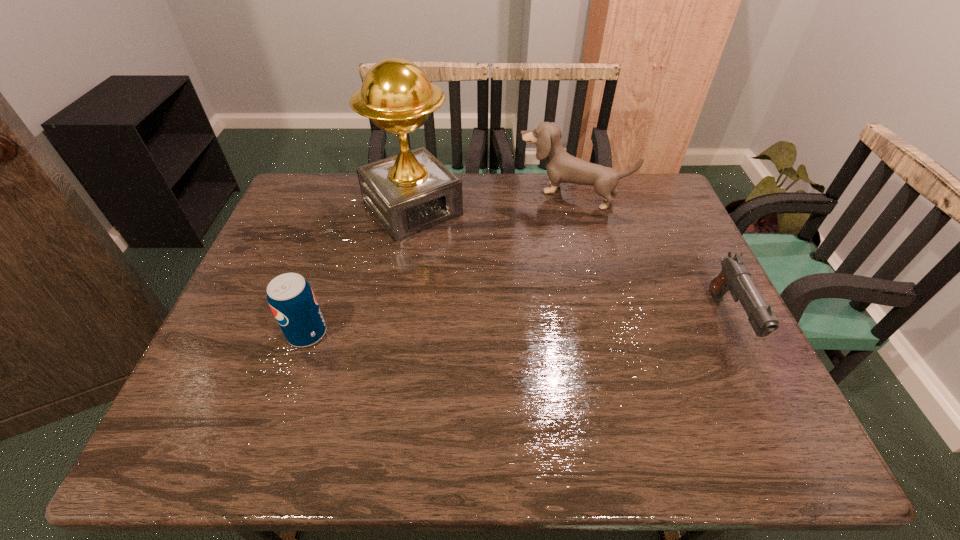
This screenshot has width=960, height=540. I want to click on free space located on the front-facing side of the award, so click(487, 292).

Where is `vacant point located on the front-facing side of the award`? The image size is (960, 540). vacant point located on the front-facing side of the award is located at coordinates (457, 258).

Find the location of a particular element. Image resolution: width=960 pixels, height=540 pixels. vacant space located on the front-facing side of the award is located at coordinates (504, 312).

The image size is (960, 540). I want to click on puppy that is positioned at the far edge, so click(x=561, y=167).

This screenshot has width=960, height=540. Identify the location of award present at the far edge. (413, 191).

The width and height of the screenshot is (960, 540). I want to click on object located at the left edge, so click(x=291, y=298).

The height and width of the screenshot is (540, 960). What are the coordinates of `gun that is at the right edge` in the screenshot? It's located at (734, 276).

At what (x,y) coordinates should I click in order to perform the action: click on puppy situated at the right edge. Please return your answer as a coordinate pair (x, y). The height and width of the screenshot is (540, 960). Looking at the image, I should click on (561, 167).

Where is `object positioned at the far right corner`? object positioned at the far right corner is located at coordinates (561, 167).

At what (x,y) coordinates should I click in order to perform the action: click on blank area at the far edge. Please return your answer as a coordinate pair (x, y). Image resolution: width=960 pixels, height=540 pixels. Looking at the image, I should click on (572, 208).